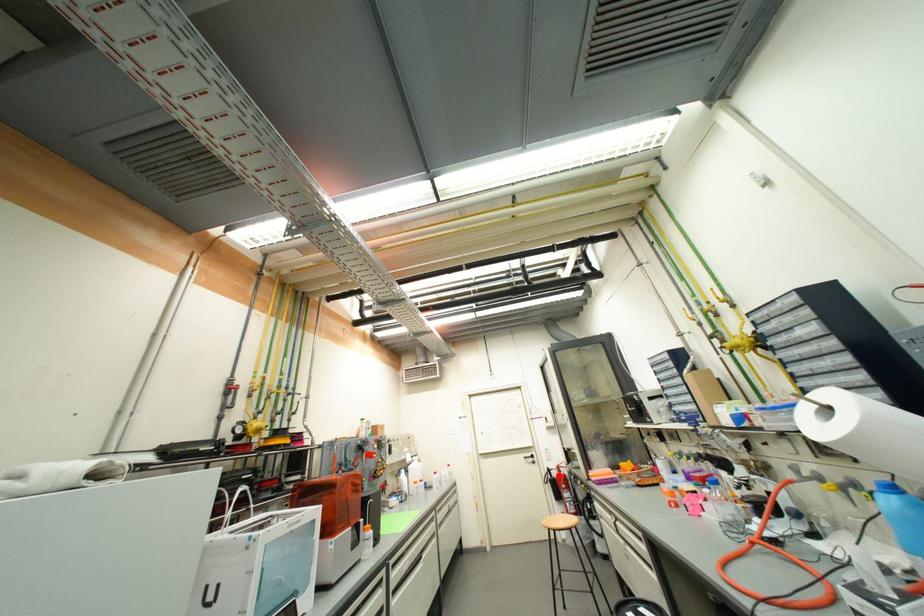
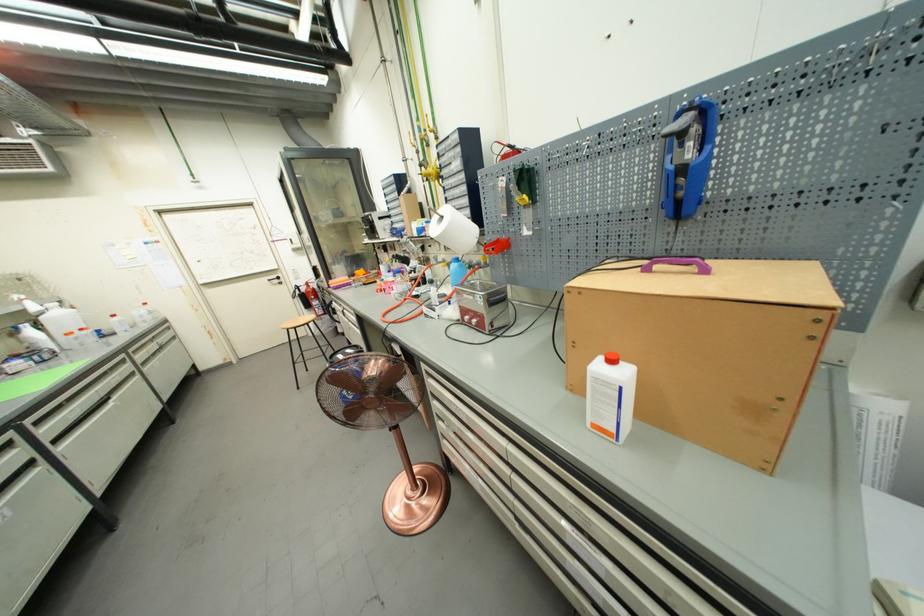
Find the pixel in the second image that matches the highlighted location in the first image.

(309, 291)